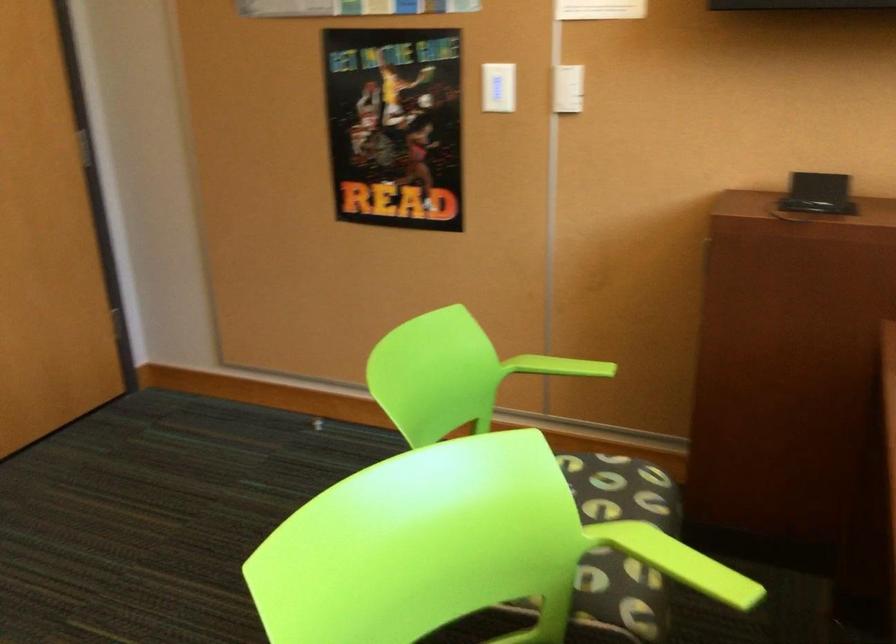
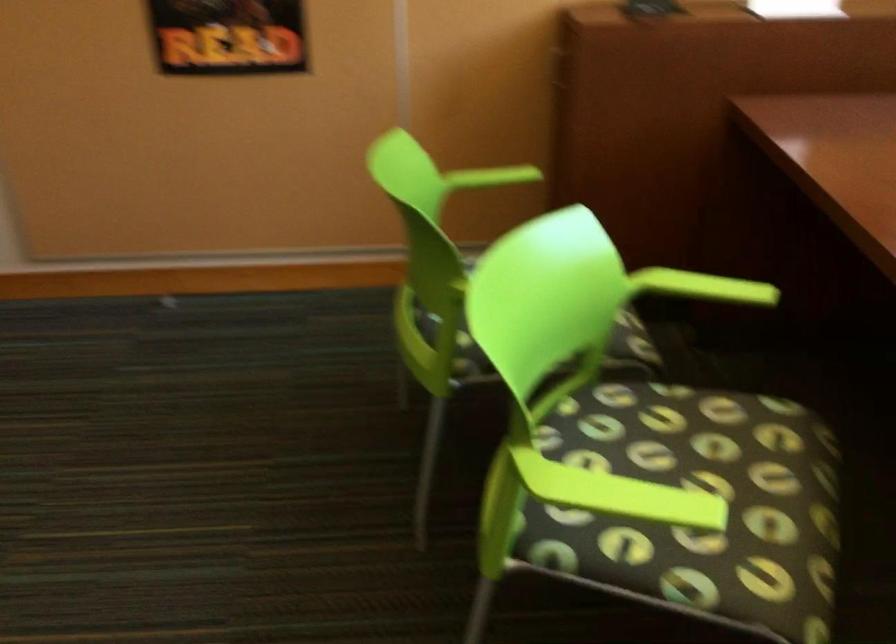
The point at (675, 558) is marked in the first image. Where is the corresponding point in the second image?

(702, 287)